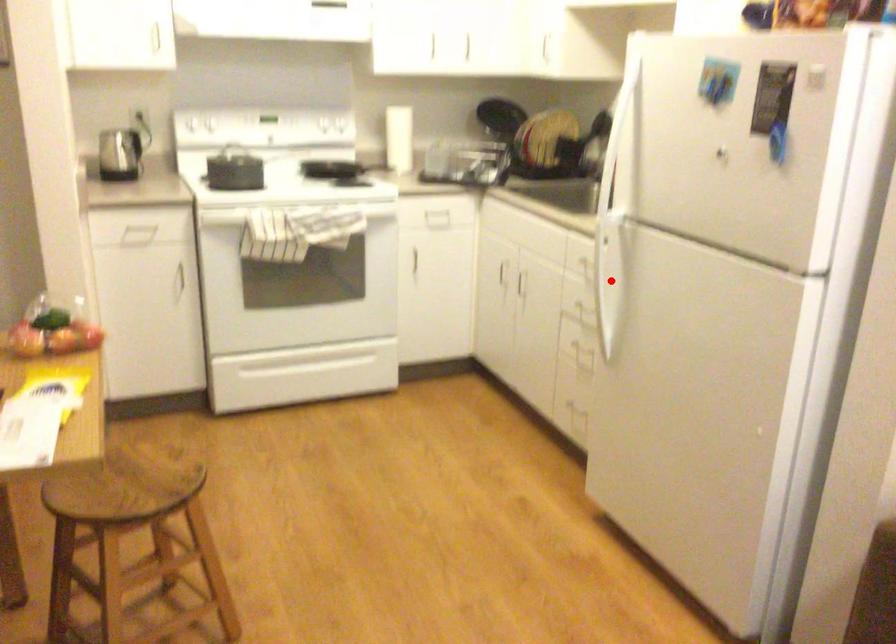
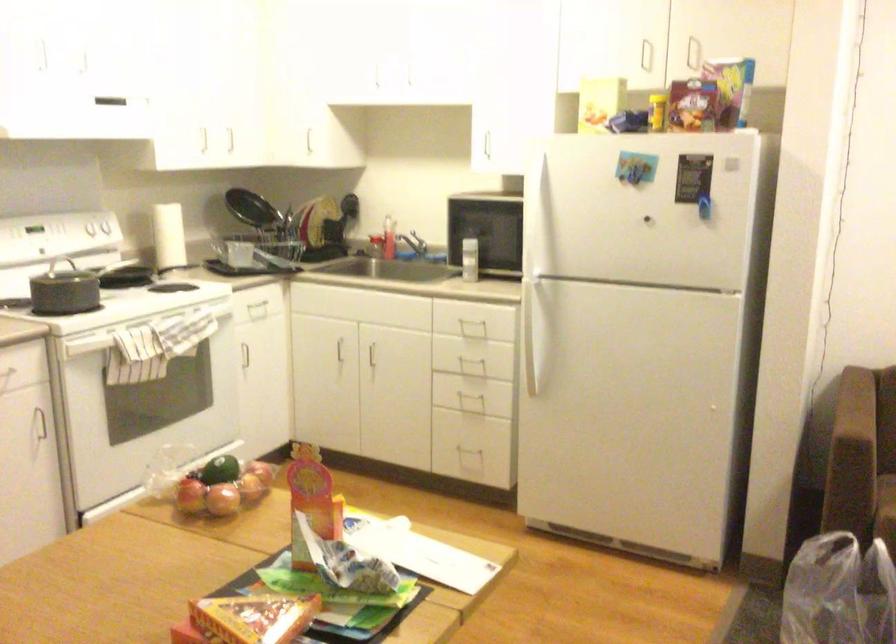
Question: I am providing you with two images of the same scene from different viewpoints. Given a red point in image1, look at the same physical point in image2. Is it:

Choices:
 (A) Closer to the viewpoint
 (B) Farther from the viewpoint

Answer: (B)